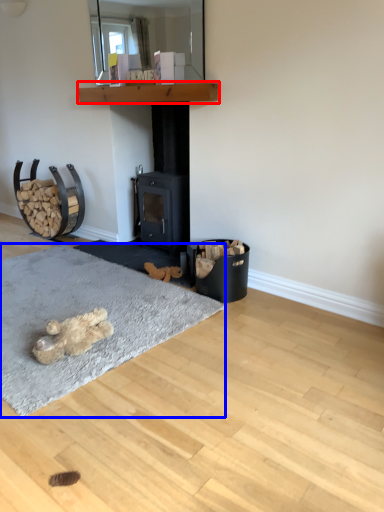
Question: Which point is closer to the camera, shelf (highlighted by a red box) or mat (highlighted by a blue box)?

Choices:
 (A) shelf
 (B) mat

Answer: (B)